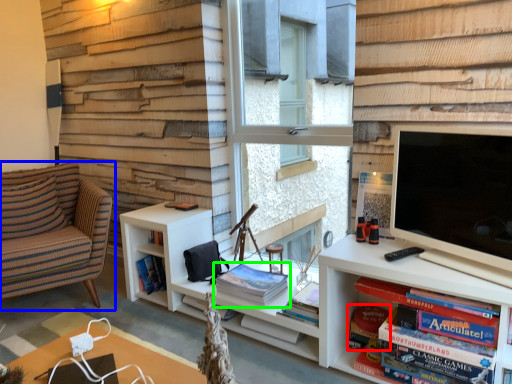
Question: Which object is the closest to the paperback book (highlighted by a red box)? Choose among these: chair (highlighted by a blue box) or book (highlighted by a green box).

Choices:
 (A) chair
 (B) book

Answer: (B)